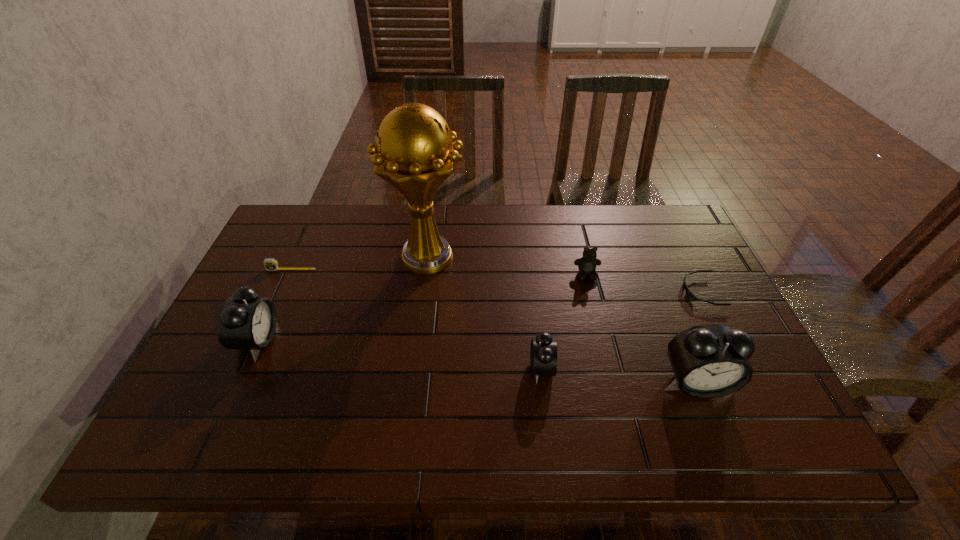
At what (x,y) coordinates should I click in order to perform the action: click on the second tallest alarm clock. Please return your answer as a coordinate pair (x, y). Looking at the image, I should click on (245, 321).

You are a GUI agent. You are given a task and a screenshot of the screen. Output one action in this format:
    pyautogui.click(x=<x>, y=<y>)
    Task: Click on the leftmost alarm clock
    This screenshot has height=540, width=960.
    Given the screenshot: What is the action you would take?
    pyautogui.click(x=245, y=321)

Image resolution: width=960 pixels, height=540 pixels. I want to click on the fourth object from left to right, so click(543, 353).

What are the coordinates of `the shortest alarm clock` in the screenshot? It's located at (543, 353).

The image size is (960, 540). Identify the location of the rightmost alarm clock. (708, 361).

This screenshot has width=960, height=540. I want to click on the third object from right to left, so click(x=587, y=264).

Identify the location of the third object from left to right. (414, 152).

Locate an element on the screen. the tallest object is located at coordinates (414, 152).

Where is `the second shortest object`? the second shortest object is located at coordinates [271, 264].

Find the location of a particular element. The image size is (960, 540). the shortest object is located at coordinates (689, 294).